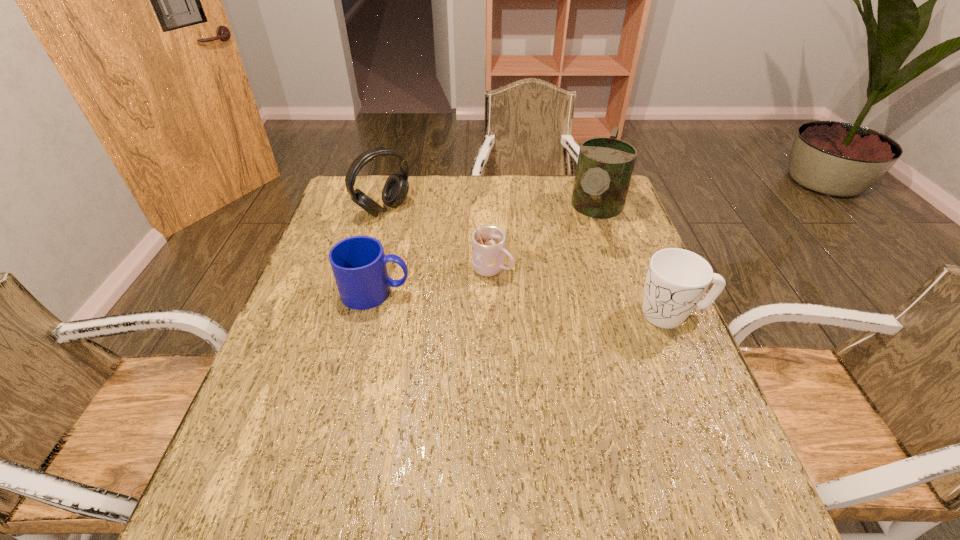
The width and height of the screenshot is (960, 540). Identify the location of free region that satisfies the following two spatial constraints: 1. on the front side of the third object from left to right; 2. on the side of the right mug with the handle. (493, 314).

Identify the location of free spot that satisfies the following two spatial constraints: 1. on the front side of the shorter mug; 2. on the side with the handle of the headset. The height and width of the screenshot is (540, 960). (361, 292).